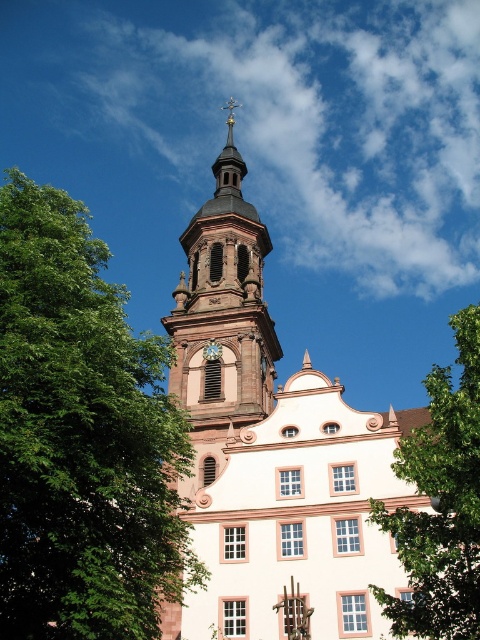
Consider the image. Is green leafy tree at upper left taller than green leafy tree at right?

Yes, green leafy tree at upper left is taller than green leafy tree at right.

The width and height of the screenshot is (480, 640). Describe the element at coordinates (82, 436) in the screenshot. I see `green leafy tree at upper left` at that location.

This screenshot has width=480, height=640. Find the location of `green leafy tree at upper left`. green leafy tree at upper left is located at coordinates (82, 436).

Does green leafy tree at right lie behind metallic gold clock at center?

No.

Is green leafy tree at right closer to the viewer compared to metallic gold clock at center?

Yes, it is.

Is point (446, 420) positioned behind point (213, 348)?

No, it is in front of (213, 348).

The image size is (480, 640). I want to click on green leafy tree at right, so click(x=441, y=502).

In the scene shown: Does white stone church at center come in front of metallic gold clock at center?

Yes, it is.

Does point (252, 394) lie behind point (206, 349)?

No, (252, 394) is closer to viewer.

Image resolution: width=480 pixels, height=640 pixels. In order to click on white stone church at center in this screenshot , I will do `click(272, 449)`.